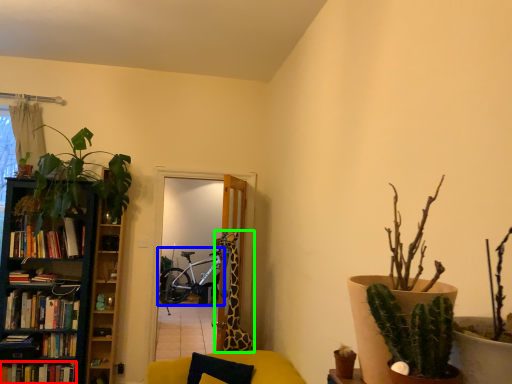
Question: Which object is the farthest from book (highlighted by a red box)? Choose among these: bicycle (highlighted by a blue box) or giraffe (highlighted by a green box).

Choices:
 (A) bicycle
 (B) giraffe

Answer: (A)